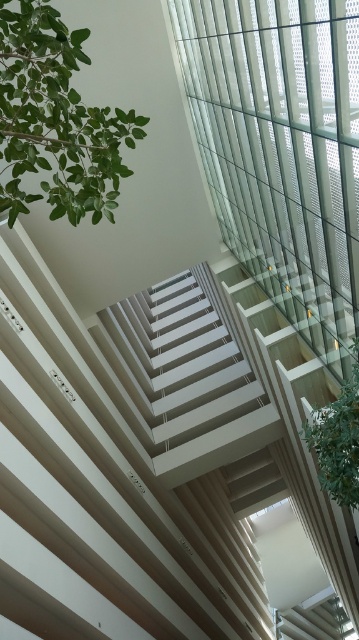
You are an interior designer planning to install a new light fixture in the space. The fixture requires a minimum of 3 meters between two points to be safely mounted. Given the distance between the green leafy plant at upper left and the green leafy plant at upper right, can you confirm if this distance meets the requirement?

The green leafy plant at upper left and green leafy plant at upper right are 4.33 meters apart, which exceeds the minimum requirement of 3 meters. Therefore, the distance between them is sufficient for safely mounting the light fixture.

You are standing in the room and want to see both green leafy plants. Which one is closer to you, the green leafy plant at upper left or the green leafy plant at upper right?

The green leafy plant at upper left is closer to you because it is in front of the green leafy plant at upper right.